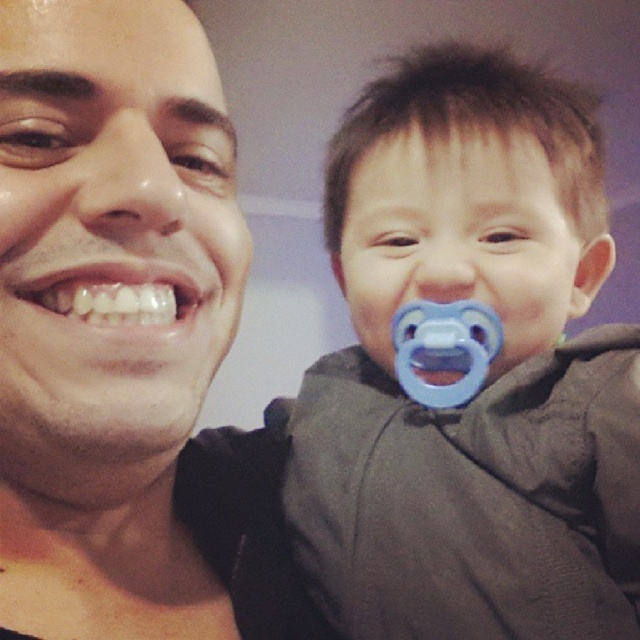
You are a dentist examining a patient. You notice the blue rubber pacifier at upper right and the white glossy teeth at center. Which object has a greater width?

The blue rubber pacifier at upper right has a greater width than the white glossy teeth at center.

You are a photographer trying to capture a closeup of the blue rubber pacifier at upper right. You are currently holding your camera at a standard distance of 12 inches from the subject for portraits. Should you move closer or farther away to frame the pacifier properly?

The blue rubber pacifier at upper right is 17.00 inches away from viewer. Since the standard distance is 12 inches, you should move closer by 5 inches to achieve the proper framing.